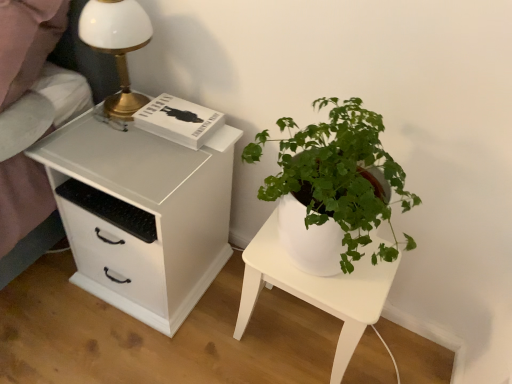
You are a GUI agent. You are given a task and a screenshot of the screen. Output one action in this format:
    pyautogui.click(x=<x>, y=<y>)
    Task: Click on the unoccupied region to the right of white glossy nightstand at lower right
    The image size is (512, 384).
    Given the screenshot: What is the action you would take?
    pyautogui.click(x=400, y=354)